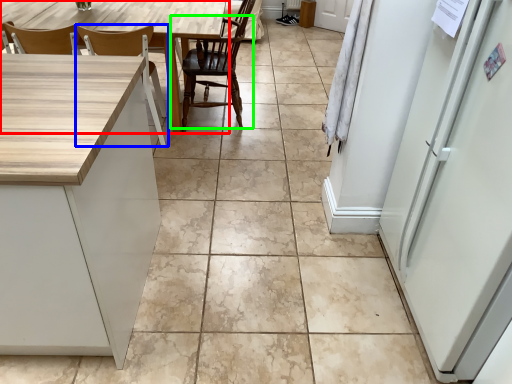
Question: Based on their relative distances, which object is nearer to table (highlighted by a red box)? Choose from chair (highlighted by a blue box) and chair (highlighted by a green box).

Choices:
 (A) chair
 (B) chair

Answer: (A)